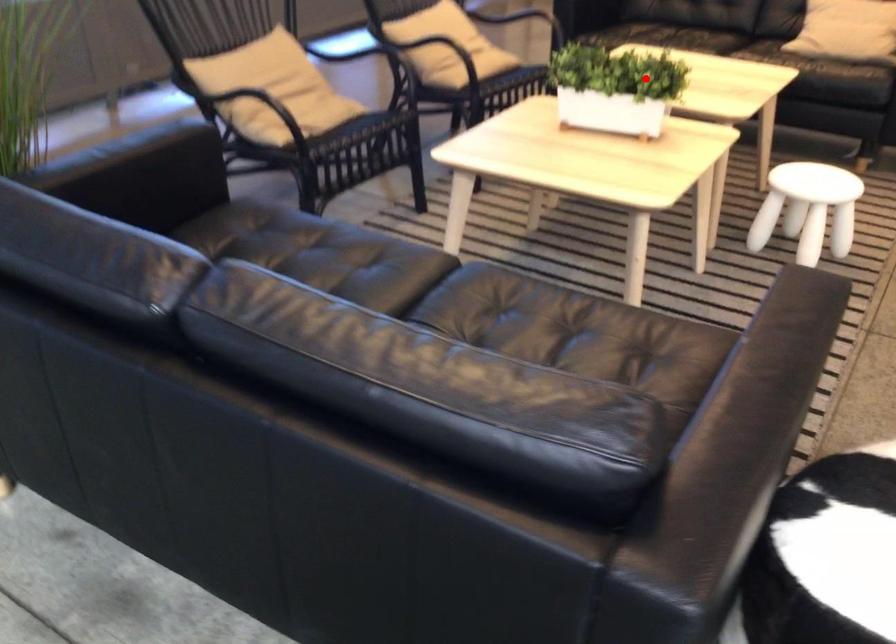
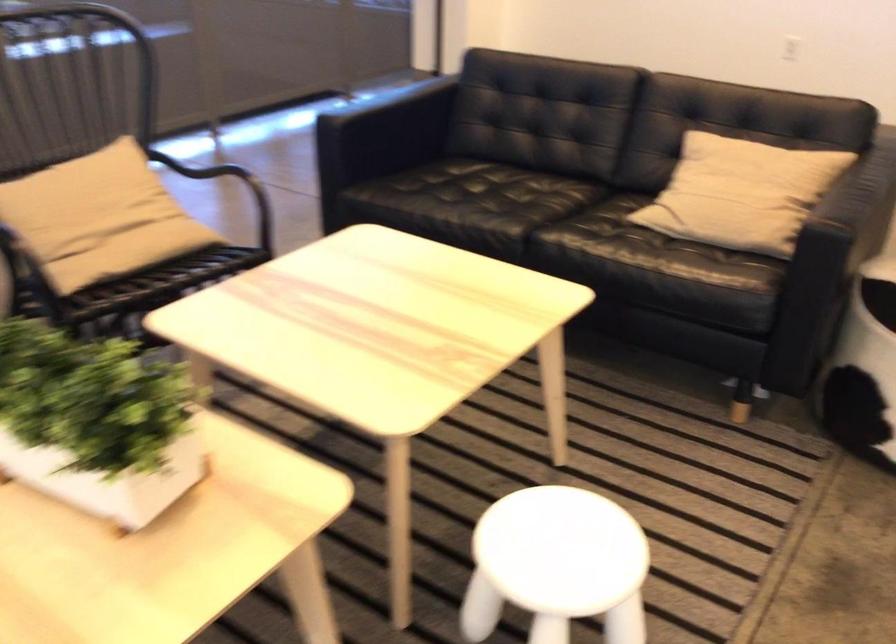
Question: I am providing you with two images of the same scene from different viewpoints. Image1 has a red point marked. In image2, the corresponding 3D location appears at what relative position? Reply with the corresponding letter.

Choices:
 (A) Closer
 (B) Farther

Answer: (A)